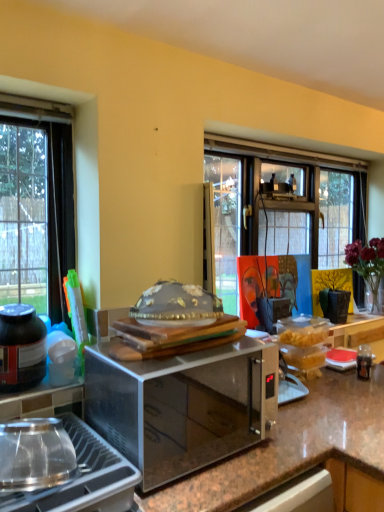
Question: In the image, is brown granite countertop at center positioned in front of or behind black matte jar at lower left?

Choices:
 (A) front
 (B) behind

Answer: (A)

Question: In terms of width, does brown granite countertop at center look wider or thinner when compared to black matte jar at lower left?

Choices:
 (A) thin
 (B) wide

Answer: (B)

Question: Which object is the farthest from the stainless steel gas stove at lower left?

Choices:
 (A) orange canvas painting at center
 (B) translucent glass vase at upper right
 (C) brown granite countertop at center
 (D) black matte jar at lower left
 (E) satin metallic microwave at center

Answer: (B)

Question: Which of these objects is positioned closest to the stainless steel gas stove at lower left?

Choices:
 (A) black matte jar at lower left
 (B) orange canvas painting at center
 (C) brown granite countertop at center
 (D) translucent glass vase at upper right
 (E) satin metallic microwave at center

Answer: (E)